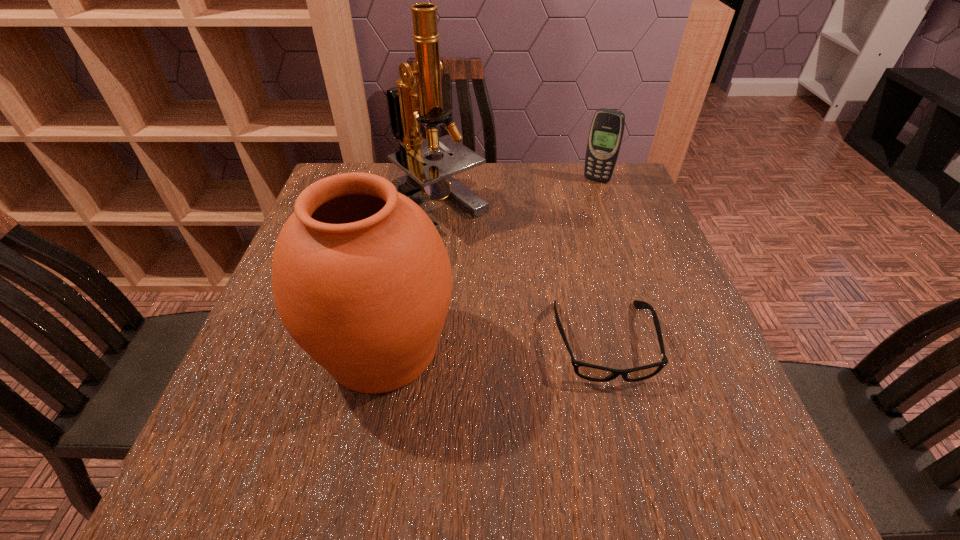
You are a GUI agent. You are given a task and a screenshot of the screen. Output one action in this format:
    pyautogui.click(x=<x>, y=<y>)
    Task: Click on the free region located 0.330m at the eyepiece of the microscope
    The width and height of the screenshot is (960, 540).
    Given the screenshot: What is the action you would take?
    pyautogui.click(x=478, y=346)

I want to click on vacant space located at the eyepiece of the microscope, so click(x=488, y=375).

Where is `cellular telephone situated at the far edge`? cellular telephone situated at the far edge is located at coordinates (606, 132).

Where is `microscope located in the far edge section of the desktop`? Image resolution: width=960 pixels, height=540 pixels. microscope located in the far edge section of the desktop is located at coordinates (425, 178).

Locate an element on the screen. This screenshot has width=960, height=540. object that is at the near edge is located at coordinates tap(362, 281).

Where is `object at the left edge`? The width and height of the screenshot is (960, 540). object at the left edge is located at coordinates (362, 281).

The width and height of the screenshot is (960, 540). In order to click on spectacles that is at the right edge in this screenshot , I will do `click(591, 372)`.

You are a GUI agent. You are given a task and a screenshot of the screen. Output one action in this format:
    pyautogui.click(x=<x>, y=<y>)
    Task: Click on the cellular telephone that is at the right edge
    The height and width of the screenshot is (540, 960).
    Given the screenshot: What is the action you would take?
    pyautogui.click(x=606, y=132)

This screenshot has height=540, width=960. Find the location of `object that is at the near left corner`. object that is at the near left corner is located at coordinates (362, 281).

The width and height of the screenshot is (960, 540). I want to click on object that is at the far right corner, so click(x=606, y=132).